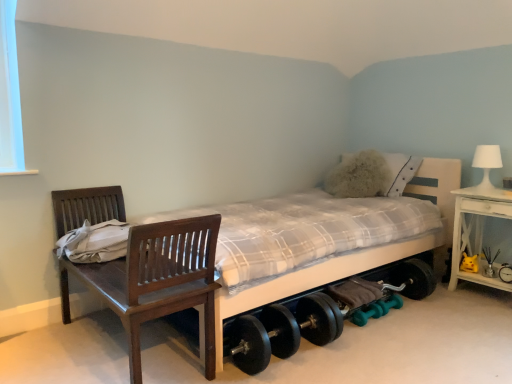
Question: Does yellow plush toy at lower right have a larger size compared to white plaid fabric bed at center?

Choices:
 (A) yes
 (B) no

Answer: (B)

Question: Does yellow plush toy at lower right have a lesser width compared to white plaid fabric bed at center?

Choices:
 (A) no
 (B) yes

Answer: (B)

Question: From the image's perspective, is yellow plush toy at lower right above white plaid fabric bed at center?

Choices:
 (A) no
 (B) yes

Answer: (A)

Question: Is yellow plush toy at lower right at the right side of white plaid fabric bed at center?

Choices:
 (A) yes
 (B) no

Answer: (A)

Question: From a real-world perspective, is yellow plush toy at lower right below white plaid fabric bed at center?

Choices:
 (A) no
 (B) yes

Answer: (B)

Question: Does yellow plush toy at lower right come in front of white plaid fabric bed at center?

Choices:
 (A) no
 (B) yes

Answer: (A)

Question: Does white plaid fabric bed at center have a lesser height compared to teal rubber dumbbell at lower center, acting as the 1th dumbbell starting from the bottom?

Choices:
 (A) no
 (B) yes

Answer: (A)

Question: Can you confirm if white plaid fabric bed at center is positioned to the left of teal rubber dumbbell at lower center, the 1th dumbbell viewed from the left?

Choices:
 (A) no
 (B) yes

Answer: (B)

Question: Does white plaid fabric bed at center have a larger size compared to teal rubber dumbbell at lower center, acting as the 1th dumbbell starting from the bottom?

Choices:
 (A) no
 (B) yes

Answer: (B)

Question: Considering the relative positions of white plaid fabric bed at center and teal rubber dumbbell at lower center, acting as the 1th dumbbell starting from the bottom, in the image provided, is white plaid fabric bed at center to the right of teal rubber dumbbell at lower center, acting as the 1th dumbbell starting from the bottom, from the viewer's perspective?

Choices:
 (A) yes
 (B) no

Answer: (B)

Question: From the image's perspective, is white plaid fabric bed at center on teal rubber dumbbell at lower center, the third dumbbell when ordered from top to bottom?

Choices:
 (A) yes
 (B) no

Answer: (A)

Question: Is white plaid fabric bed at center surrounding teal rubber dumbbell at lower center, the third dumbbell when ordered from top to bottom?

Choices:
 (A) no
 (B) yes

Answer: (B)

Question: Is yellow plush toy at lower right taller than white matte table lamp at upper right?

Choices:
 (A) yes
 (B) no

Answer: (B)